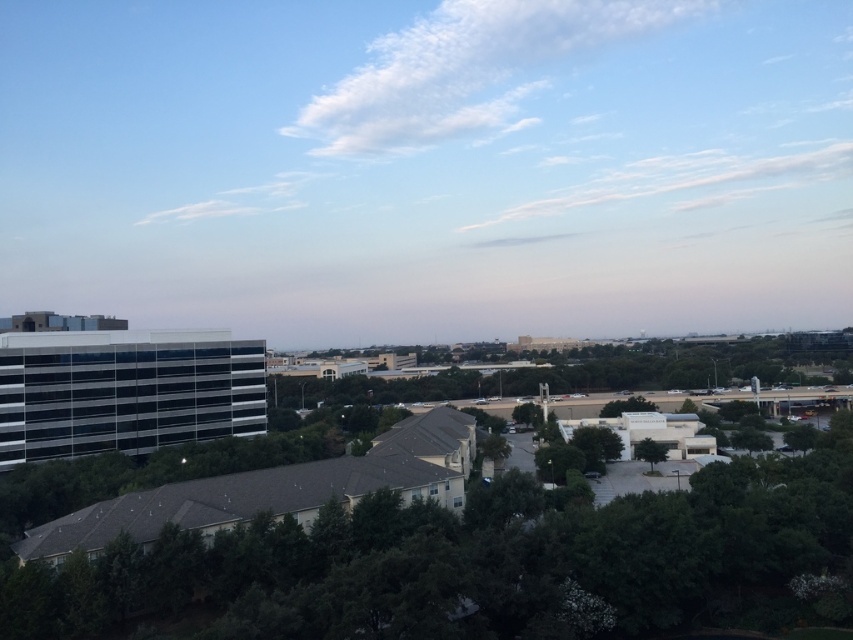
Question: Is green leafy tree at center above green leafy tree at center-right?

Choices:
 (A) yes
 (B) no

Answer: (A)

Question: Which object appears closest to the camera in this image?

Choices:
 (A) green leafy tree at center
 (B) green leafy tree at center-right

Answer: (A)

Question: Which point is farther to the camera?

Choices:
 (A) green leafy tree at center
 (B) green leafy tree at center-right

Answer: (B)

Question: Does green leafy tree at center appear on the left side of green leafy tree at center-right?

Choices:
 (A) yes
 (B) no

Answer: (A)

Question: In this image, where is green leafy tree at center located relative to green leafy tree at center-right?

Choices:
 (A) left
 (B) right

Answer: (A)

Question: Which of the following is the closest to the observer?

Choices:
 (A) (636, 454)
 (B) (247, 580)

Answer: (B)